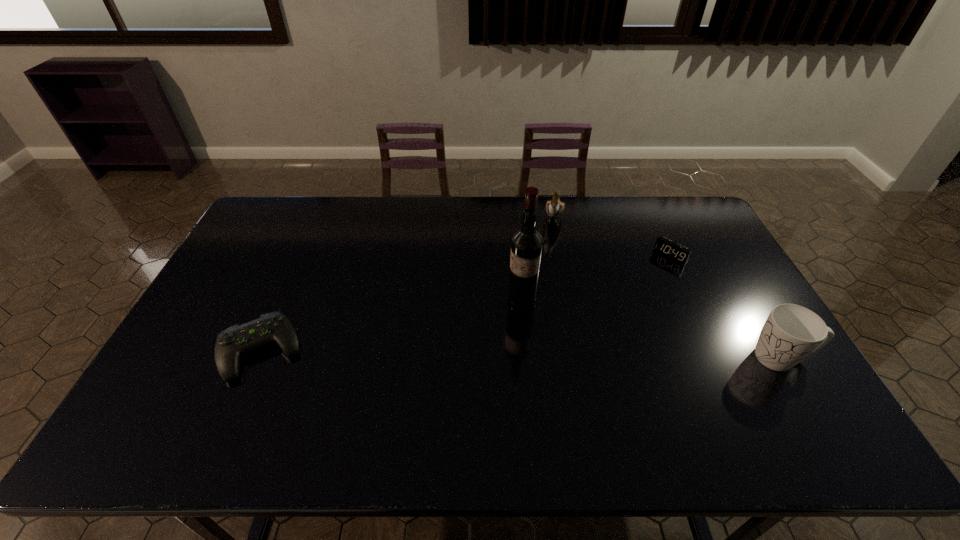
This screenshot has height=540, width=960. Find the location of `free region at the near edge of the desktop`. free region at the near edge of the desktop is located at coordinates [404, 388].

The image size is (960, 540). In the image, there is a desktop. Find the location of `vacant region at the left edge`. vacant region at the left edge is located at coordinates (234, 284).

The height and width of the screenshot is (540, 960). In the image, there is a desktop. What are the coordinates of `free region at the right edge` in the screenshot? It's located at (710, 238).

The image size is (960, 540). What are the coordinates of `vacant area at the far left corner` in the screenshot? It's located at (291, 215).

Locate an element on the screen. This screenshot has width=960, height=540. free space between the bird and the leftmost object is located at coordinates (407, 283).

The height and width of the screenshot is (540, 960). I want to click on vacant point located between the tallest object and the fourth nearest object, so click(x=596, y=279).

You are a GUI agent. You are given a task and a screenshot of the screen. Output one action in this format:
    pyautogui.click(x=<x>, y=<y>)
    Task: Click on the free space between the farthest object and the control
    
    Given the screenshot: What is the action you would take?
    pyautogui.click(x=407, y=283)

Where is `empty space that is in between the rightmost object and the second object from left to right`? This screenshot has height=540, width=960. empty space that is in between the rightmost object and the second object from left to right is located at coordinates (652, 329).

Find the location of a particular element. vacant point located between the control and the mug is located at coordinates (521, 354).

Find the location of a particular element. vacant region between the mug and the tallest object is located at coordinates (652, 329).